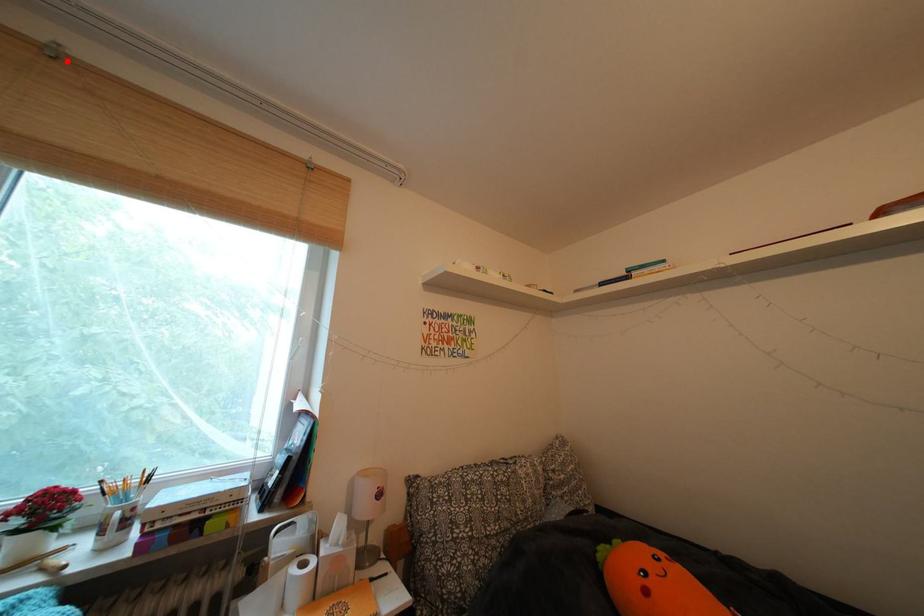
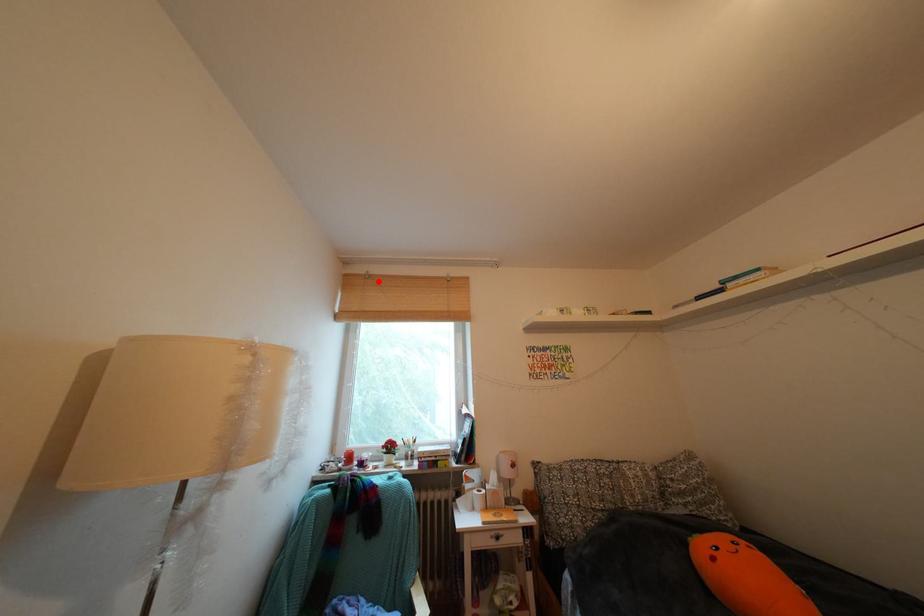
I am providing you with two images of the same scene from different viewpoints. A red point is marked on the first image and another point is marked on the second image. Is the red point in image1 aligned with the point shown in image2?

Yes